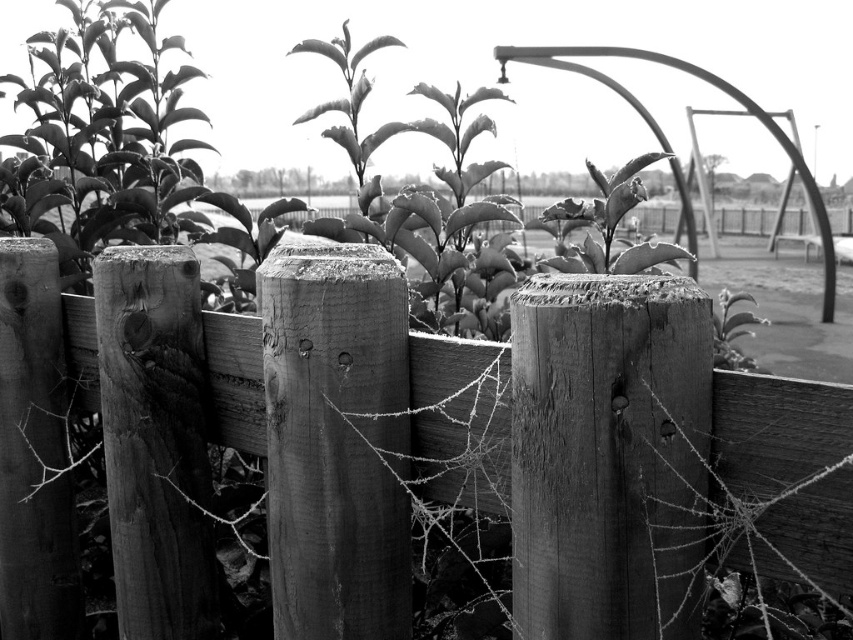
Based on the scene description, where is the wooden fence at center located in terms of coordinates?

The wooden fence at center is located at point coordinates of (x=250, y=428).

You are standing in front of the wooden fence at center and the smooth green leaf at center. Which object is closer to your right side?

The smooth green leaf at center is closer to your right side because the wooden fence at center is to the left of it.

You are a gardener trying to determine if the smooth green leaf at center can be fully visible without obstruction from the wooden fence at center. Based on their sizes, is this possible?

The wooden fence at center is larger in size than smooth green leaf at center, so the leaf might be partially or fully obscured by the fence depending on their exact positions.